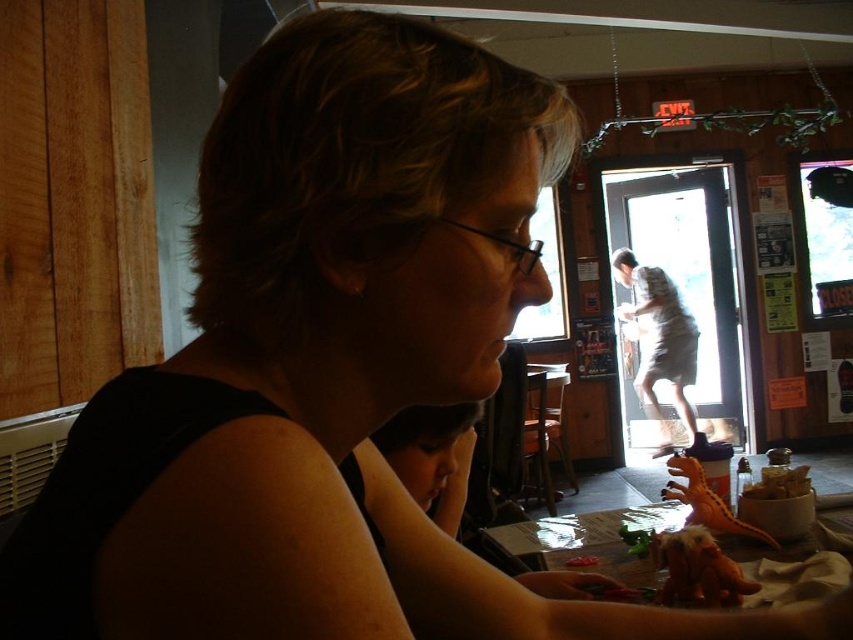
You are a waiter in a restaurant and need to place a new plate on the wooden table at lower center. The plate is as wide as the brown crumbly food at lower right. Can you fit the plate on the table without overlapping any existing items?

The wooden table at lower center is wider than the brown crumbly food at lower right, so the plate can fit on the table as long as there is enough space between existing items.

You are a waiter in a restaurant and you need to deliver a plate of food to the wooden table at lower center. There is brown crumbly food at lower right on the floor. Can you walk directly to the table without stepping on the food?

The wooden table at lower center is in front of brown crumbly food at lower right, so you can walk directly to the wooden table at lower center without stepping on the brown crumbly food at lower right.

You are a waiter in a restaurant and need to clear the brown crumbly food at lower right from the wooden table at lower center. Can you fit the food into a trash bin that has an opening of 15 cm in diameter?

The wooden table at lower center is larger in size than brown crumbly food at lower right, but the size of the food itself is not specified. Therefore, it is uncertain if the brown crumbly food at lower right will fit into the trash bin with a 15 cm opening.